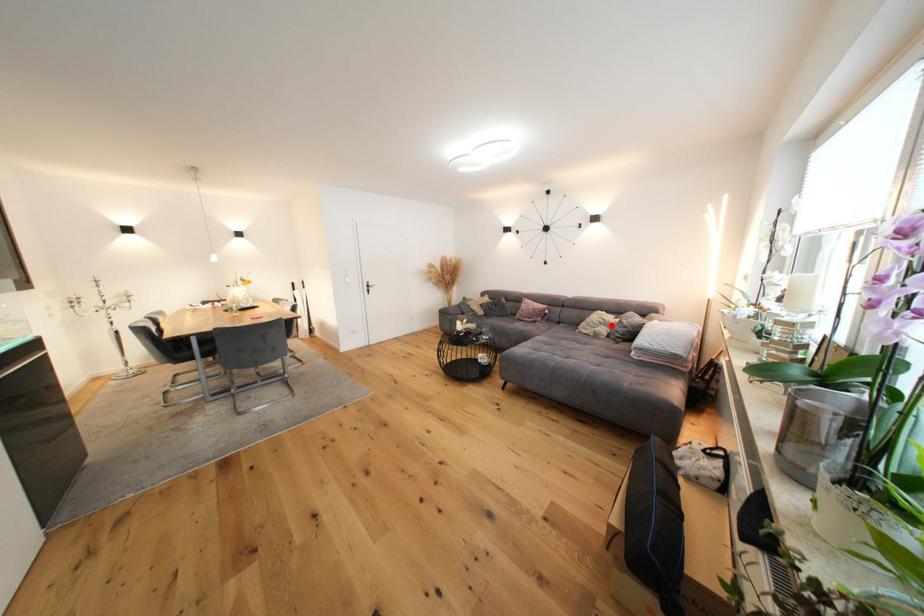
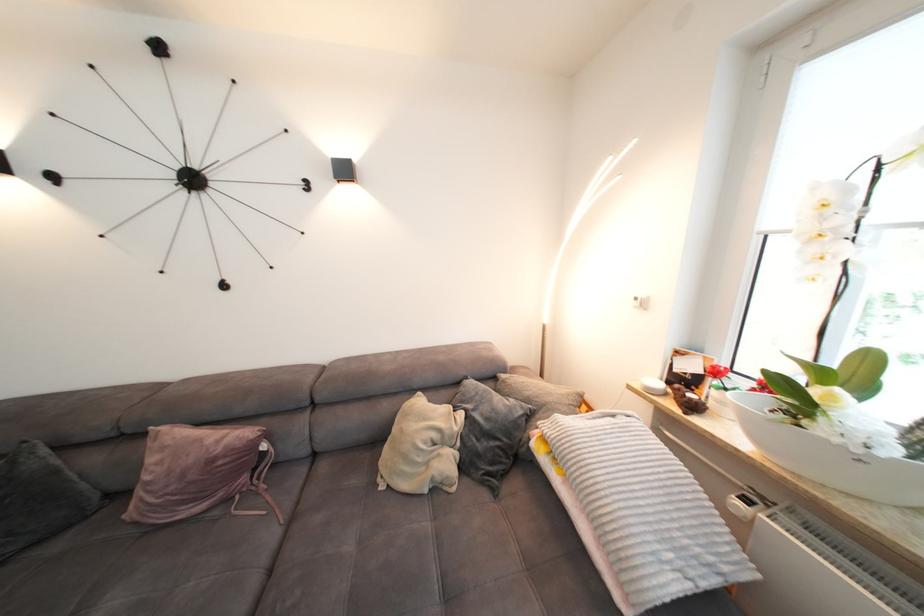
Find the pixel in the second image that matches the highlighted location in the first image.

(450, 440)